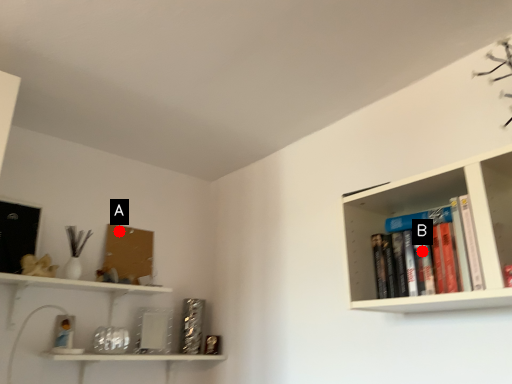
Question: Two points are circled on the image, labeled by A and B beside each circle. Which point is closer to the camera taking this photo?

Choices:
 (A) A is closer
 (B) B is closer

Answer: (B)